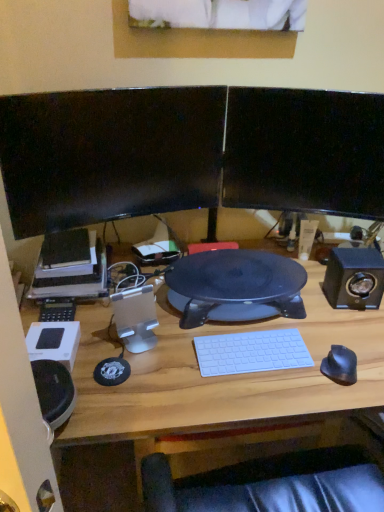
At what (x,y) coordinates should I click in order to perform the action: click on black plastic desk at center. Please return your answer as a coordinate pair (x, y). The width and height of the screenshot is (384, 512). Looking at the image, I should click on (235, 287).

Image resolution: width=384 pixels, height=512 pixels. In order to click on wooden desk at center in this screenshot , I will do `click(222, 376)`.

This screenshot has height=512, width=384. Describe the element at coordinates (57, 310) in the screenshot. I see `black plastic calculator at left` at that location.

This screenshot has width=384, height=512. I want to click on black matte speaker at right, which ranks as the second speaker in front-to-back order, so click(x=354, y=278).

At what (x,y) coordinates should I click in order to perform the action: click on black plastic desk at center. Please return your answer as a coordinate pair (x, y). This screenshot has width=384, height=512. Looking at the image, I should click on (235, 287).

Is white plastic keyboard at center thinner than black plastic desk at center?

Indeed, white plastic keyboard at center has a lesser width compared to black plastic desk at center.

Is white plastic keyboard at center facing away from black plastic desk at center?

Absolutely, white plastic keyboard at center is directed away from black plastic desk at center.

Considering the relative positions of white plastic keyboard at center and black plastic desk at center in the image provided, is white plastic keyboard at center to the right of black plastic desk at center from the viewer's perspective?

Yes.

Is black plastic calculator at left next to black glossy monitor at upper left, the 1th computer monitor in the left-to-right sequence, and touching it?

No, black plastic calculator at left is not making contact with black glossy monitor at upper left, the 1th computer monitor in the left-to-right sequence.

At what (x,y) coordinates should I click in order to perform the action: click on equipment located behind the black glossy monitor at upper left, positioned as the second computer monitor in right-to-left order. Please return your answer as a coordinate pair (x, y). The width and height of the screenshot is (384, 512). Looking at the image, I should click on point(57,310).

Based on their sizes in the image, would you say black plastic calculator at left is bigger or smaller than black glossy monitor at upper left, positioned as the second computer monitor in right-to-left order?

In the image, black plastic calculator at left appears to be smaller than black glossy monitor at upper left, positioned as the second computer monitor in right-to-left order.

Is black plastic calculator at left oriented away from black glossy monitor at upper left, the 1th computer monitor in the left-to-right sequence?

black plastic calculator at left does not have its back to black glossy monitor at upper left, the 1th computer monitor in the left-to-right sequence.

Between white plastic speaker at center, acting as the 1th speaker starting from the left, and black matte mouse at right, which one appears on the right side from the viewer's perspective?

black matte mouse at right is more to the right.

From the image's perspective, which speaker is the 1st one above the black matte mouse at right? Please provide its 2D coordinates.

[(135, 318)]

Does white plastic speaker at center, marked as the 1th speaker in a front-to-back arrangement, lie behind black matte mouse at right?

Yes, the depth of white plastic speaker at center, marked as the 1th speaker in a front-to-back arrangement, is greater than that of black matte mouse at right.

Is white plastic speaker at center, the 2th speaker in the right-to-left sequence, taller or shorter than black matte mouse at right?

white plastic speaker at center, the 2th speaker in the right-to-left sequence, is taller than black matte mouse at right.

Who is bigger, matte black printer at left or black glossy monitor at upper right, the second computer monitor from the left?

matte black printer at left is bigger.

Considering the positions of objects matte black printer at left and black glossy monitor at upper right, the 1th computer monitor positioned from the right, in the image provided, who is more to the left, matte black printer at left or black glossy monitor at upper right, the 1th computer monitor positioned from the right,?

matte black printer at left.

Is matte black printer at left wider than black glossy monitor at upper right, the 1th computer monitor positioned from the right?

Yes, matte black printer at left is wider than black glossy monitor at upper right, the 1th computer monitor positioned from the right.

Is point (64, 233) behind point (258, 190)?

That is False.

Considering the sizes of objects black matte speaker at right, the first speaker from the right, and white plastic speaker at center, acting as the 1th speaker starting from the left, in the image provided, who is wider, black matte speaker at right, the first speaker from the right, or white plastic speaker at center, acting as the 1th speaker starting from the left,?

black matte speaker at right, the first speaker from the right, is wider.

Considering the relative sizes of black matte speaker at right, which ranks as the second speaker in front-to-back order, and white plastic speaker at center, acting as the 1th speaker starting from the left, in the image provided, is black matte speaker at right, which ranks as the second speaker in front-to-back order, bigger than white plastic speaker at center, acting as the 1th speaker starting from the left,?

Yes.

Between black matte speaker at right, which ranks as the 2th speaker in left-to-right order, and white plastic speaker at center, the 2th speaker in the right-to-left sequence, which one appears on the left side from the viewer's perspective?

From the viewer's perspective, white plastic speaker at center, the 2th speaker in the right-to-left sequence, appears more on the left side.

Considering the sizes of objects black matte speaker at right, the first speaker from the right, and black matte mouse at right in the image provided, who is bigger, black matte speaker at right, the first speaker from the right, or black matte mouse at right?

With larger size is black matte speaker at right, the first speaker from the right.

Which object is closer to the camera taking this photo, black matte speaker at right, which ranks as the second speaker in front-to-back order, or black matte mouse at right?

Positioned in front is black matte mouse at right.

In the image, there is a black matte speaker at right, which ranks as the second speaker in front-to-back order. Identify the location of mouse below it (from the image's perspective). The height and width of the screenshot is (512, 384). (340, 365).

Is white plastic keyboard at center facing towards matte black printer at left?

No.

From a real-world perspective, between white plastic keyboard at center and matte black printer at left, who is vertically higher?

matte black printer at left, from a real-world perspective.

Does white plastic keyboard at center have a smaller size compared to matte black printer at left?

Yes, white plastic keyboard at center is smaller than matte black printer at left.

The height and width of the screenshot is (512, 384). I want to click on computer keyboard that appears below the black plastic desk at center (from the image's perspective), so click(x=251, y=352).

Where is `the 1st computer monitor directly above the black plastic calculator at left (from a real-world perspective)`? The height and width of the screenshot is (512, 384). the 1st computer monitor directly above the black plastic calculator at left (from a real-world perspective) is located at coordinates (109, 155).

Based on the photo, based on their spatial positions, is black matte speaker at right, the first speaker from the right, or matte black printer at left further from black glossy monitor at upper right, the second computer monitor from the left?

Based on the image, matte black printer at left appears to be further to black glossy monitor at upper right, the second computer monitor from the left.

From the image, which object appears to be nearer to black matte mouse at right, black matte speaker at right, which ranks as the 1th speaker in back-to-front order, or white plastic keyboard at center?

The object closer to black matte mouse at right is white plastic keyboard at center.

From the image, which object appears to be farther from black plastic calculator at left, black glossy monitor at upper right, the 1th computer monitor positioned from the right, or black glossy monitor at upper left, the 1th computer monitor in the left-to-right sequence?

black glossy monitor at upper right, the 1th computer monitor positioned from the right, is further to black plastic calculator at left.

From the image, which object appears to be nearer to black matte speaker at right, which ranks as the 1th speaker in back-to-front order, black plastic desk at center or black plastic calculator at left?

Among the two, black plastic desk at center is located nearer to black matte speaker at right, which ranks as the 1th speaker in back-to-front order.

Which object lies nearer to the anchor point matte black printer at left, white plastic keyboard at center or wooden desk at center?

wooden desk at center lies closer to matte black printer at left than the other object.

Considering their positions, is matte black printer at left positioned closer to black matte speaker at right, which ranks as the second speaker in front-to-back order, than white plastic keyboard at center?

The object closer to black matte speaker at right, which ranks as the second speaker in front-to-back order, is white plastic keyboard at center.

When comparing their distances from black matte mouse at right, does black glossy monitor at upper left, the 1th computer monitor in the left-to-right sequence, or black matte speaker at right, which ranks as the 2th speaker in left-to-right order, seem closer?

Among the two, black matte speaker at right, which ranks as the 2th speaker in left-to-right order, is located nearer to black matte mouse at right.

Looking at the image, which one is located further to black matte speaker at right, the first speaker from the right, white plastic keyboard at center or black matte mouse at right?

The object further to black matte speaker at right, the first speaker from the right, is white plastic keyboard at center.

Image resolution: width=384 pixels, height=512 pixels. Identify the location of computer keyboard between matte black printer at left and wooden desk at center. (251, 352).

Find the location of a particular element. The height and width of the screenshot is (512, 384). speaker between matte black printer at left and black glossy monitor at upper right, the 1th computer monitor positioned from the right is located at coordinates (135, 318).

The height and width of the screenshot is (512, 384). Find the location of `mouse between white plastic speaker at center, acting as the 1th speaker starting from the left, and black matte speaker at right, which ranks as the second speaker in front-to-back order, in the horizontal direction`. mouse between white plastic speaker at center, acting as the 1th speaker starting from the left, and black matte speaker at right, which ranks as the second speaker in front-to-back order, in the horizontal direction is located at coordinates (340, 365).

Identify the location of desk located between matte black printer at left and black matte speaker at right, which ranks as the 2th speaker in left-to-right order, in the left-right direction. (222, 376).